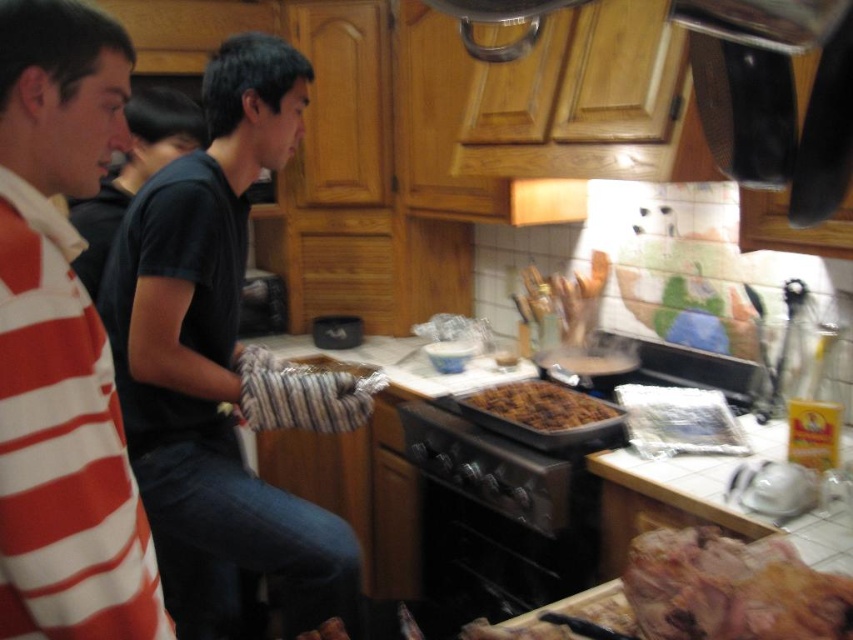
Is brown crispy meat at lower right wider than black metal stove at center?

Incorrect, brown crispy meat at lower right's width does not surpass black metal stove at center's.

Is point (698, 612) in front of point (527, 445)?

That is True.

Find the location of a particular element. brown crispy meat at lower right is located at coordinates (730, 588).

Which is more to the right, white striped shirt at left or brown crispy meat at lower right?

brown crispy meat at lower right

Which of these two, white striped shirt at left or brown crispy meat at lower right, stands shorter?

Standing shorter between the two is brown crispy meat at lower right.

You are a GUI agent. You are given a task and a screenshot of the screen. Output one action in this format:
    pyautogui.click(x=<x>, y=<y>)
    Task: Click on the white striped shirt at left
    The height and width of the screenshot is (640, 853).
    Given the screenshot: What is the action you would take?
    pyautogui.click(x=62, y=342)

Can you confirm if striped fabric oven mitt at center is positioned to the left of black metal stove at center?

Correct, you'll find striped fabric oven mitt at center to the left of black metal stove at center.

Image resolution: width=853 pixels, height=640 pixels. What do you see at coordinates (215, 362) in the screenshot?
I see `striped fabric oven mitt at center` at bounding box center [215, 362].

The width and height of the screenshot is (853, 640). I want to click on striped fabric oven mitt at center, so click(x=215, y=362).